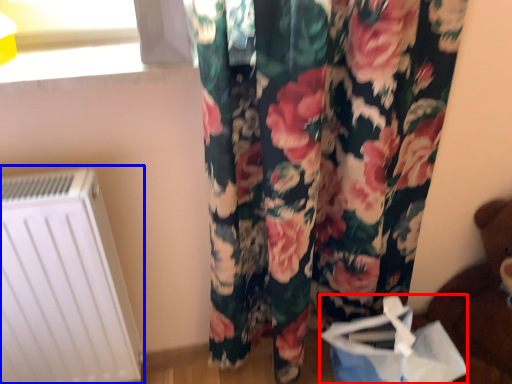
Question: Which point is further to the camera, shopping bag (highlighted by a red box) or radiator (highlighted by a blue box)?

Choices:
 (A) shopping bag
 (B) radiator

Answer: (A)